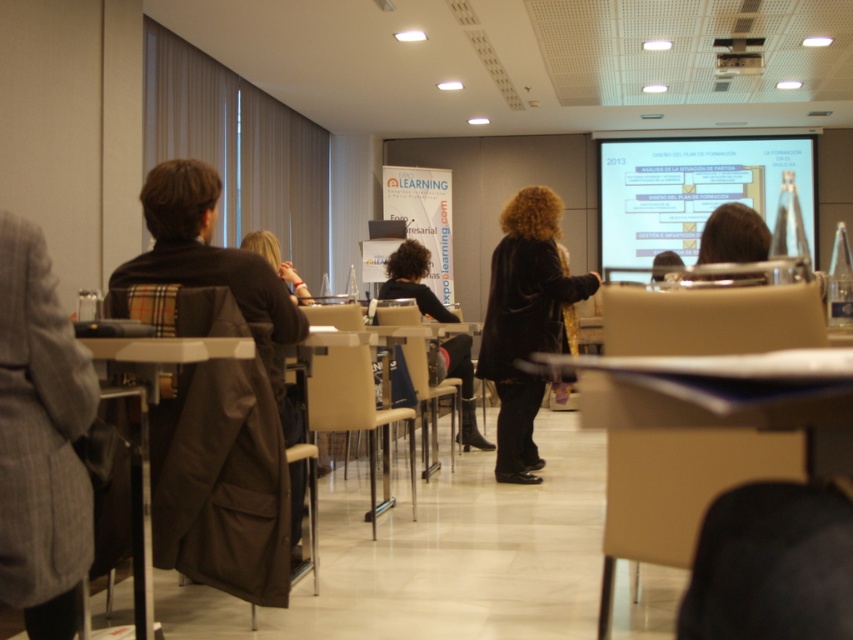
Question: Which object appears closest to the camera in this image?

Choices:
 (A) metallic projector at upper center
 (B) white glossy projection screen at upper center

Answer: (A)

Question: Does white glossy projection screen at upper center have a greater width compared to metallic silver table at center?

Choices:
 (A) no
 (B) yes

Answer: (B)

Question: Estimate the real-world distances between objects in this image. Which object is closer to the beige fabric chair at center?

Choices:
 (A) white glossy projection screen at upper center
 (B) metallic silver table at center

Answer: (B)

Question: Is white glossy projection screen at upper center bigger than velvet black coat at center?

Choices:
 (A) yes
 (B) no

Answer: (A)

Question: Does metallic silver table at center have a smaller size compared to black leather jacket at center?

Choices:
 (A) yes
 (B) no

Answer: (A)

Question: Considering the real-world distances, which object is farthest from the black leather jacket at center?

Choices:
 (A) white glossy projection screen at upper center
 (B) metallic projector at upper center
 (C) beige fabric chair at center

Answer: (A)